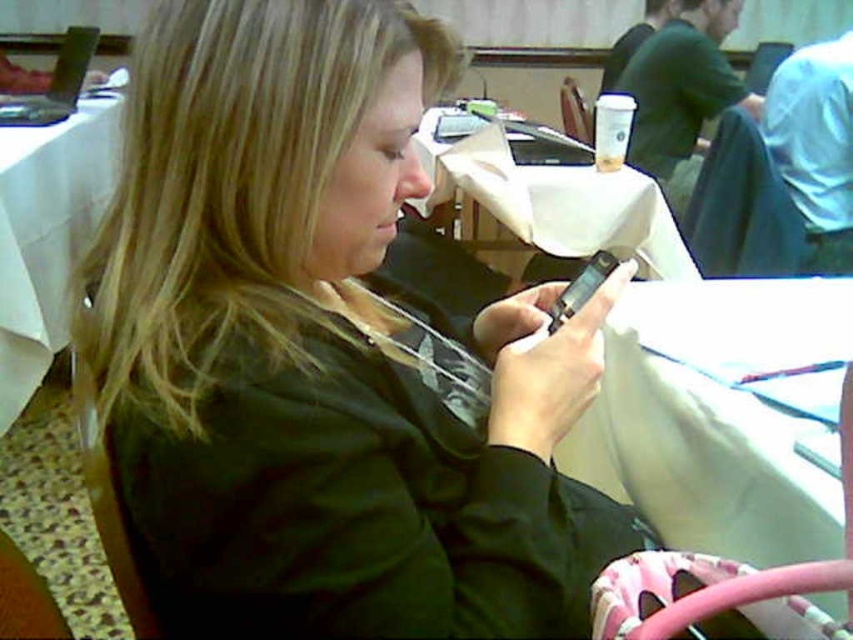
You are a person who wants to sit down at the white fabric table at lower right. There is a wooden chair at center. Will the chair be too tall for the table?

The white fabric table at lower right is shorter than the wooden chair at center, so the chair may be too tall for the table, making it uncomfortable to sit.

You are a waiter in a restaurant. You need to place a large plate of food on the table. The plate is too big to fit between the white cloth at left and the wooden chair at center. Where should you place it?

The white cloth at left is wider than the wooden chair at center, so you should place the large plate of food on the side of the white cloth at left where there is more space.

You are a server in a restaurant. You need to place a new order for the customer at the table. The order includes a plate with a main dish. Where should you place the plate so it doesn not block the white paper at center and the wooden chair at center?

The white paper at center is to the left of wooden chair at center. To avoid blocking both, place the plate to the right of the wooden chair at center since there is space available there.